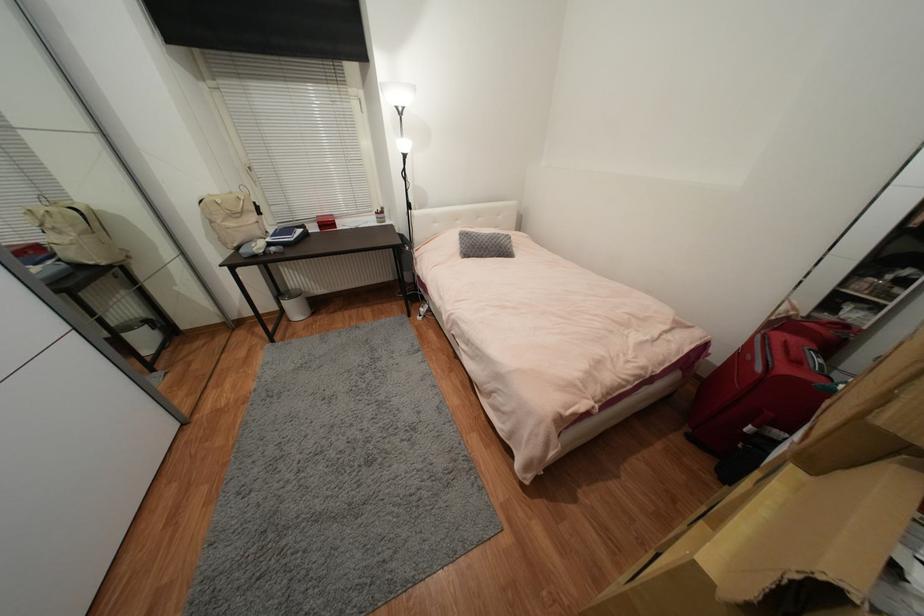
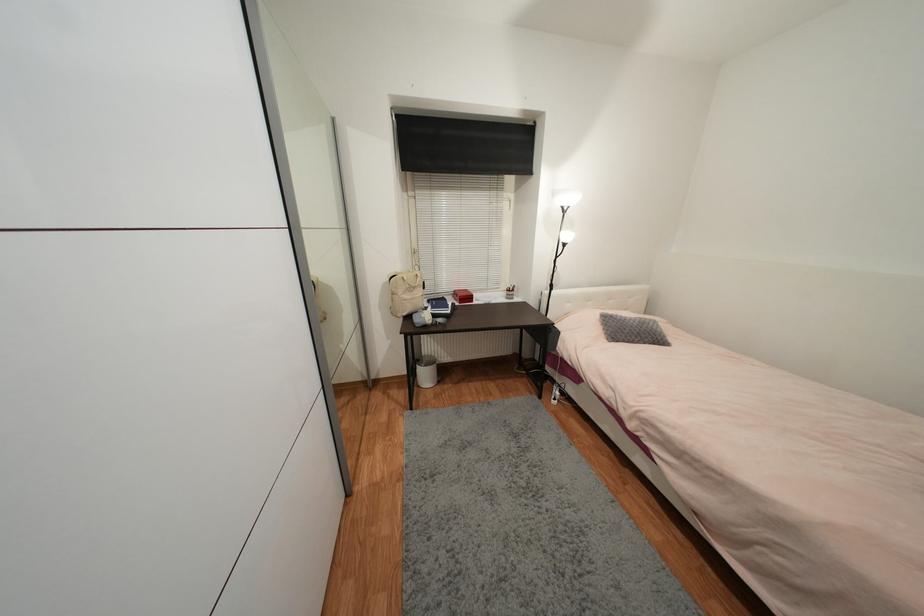
The point at (490, 241) is marked in the first image. Where is the corresponding point in the second image?

(639, 326)